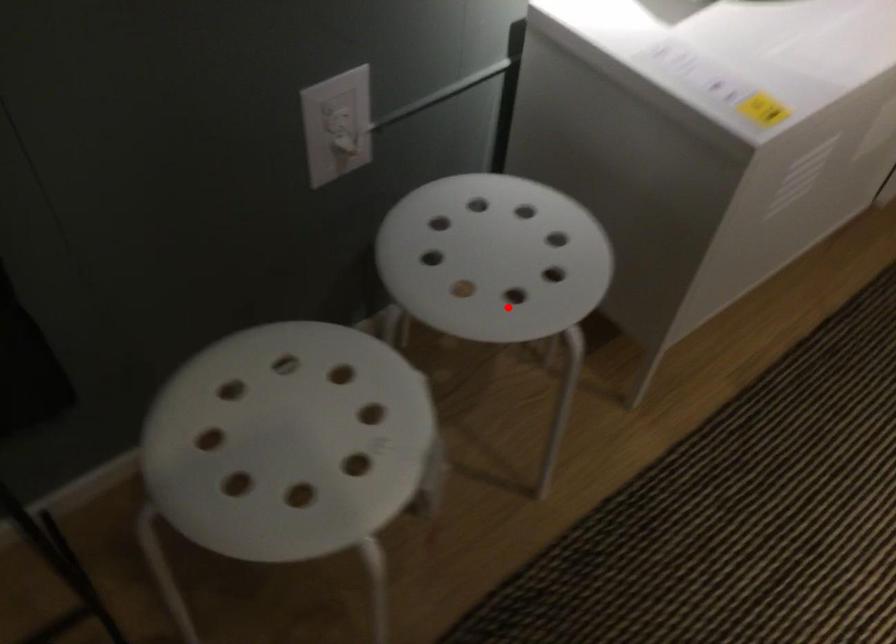
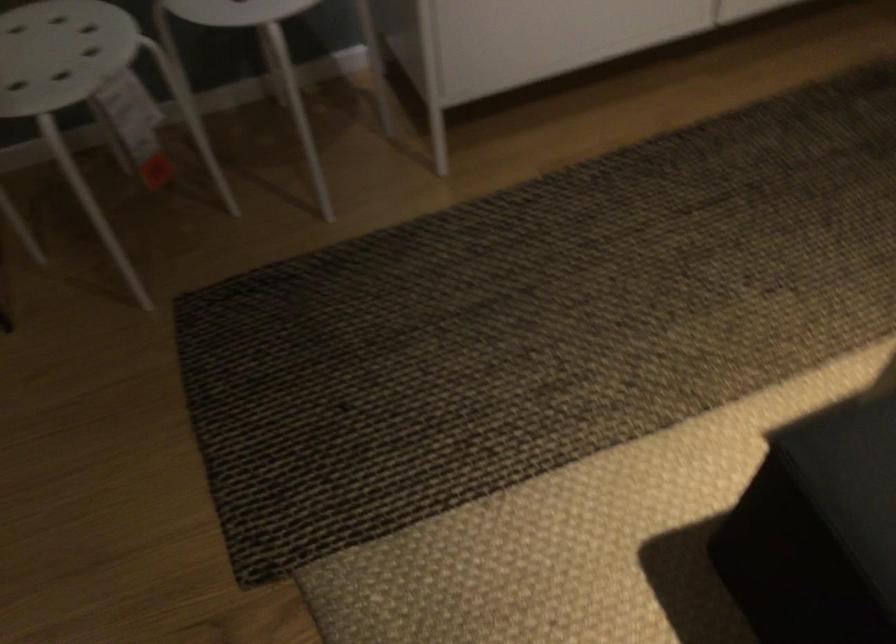
In the second image, find the point that corresponds to the highlighted location in the first image.

(235, 11)